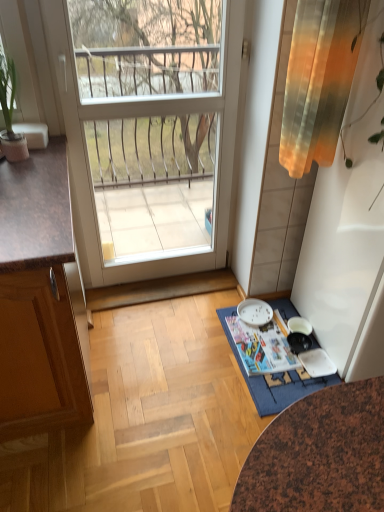
Question: In the image, is white glossy plate at lower center on the left side or the right side of gradient fabric curtain at upper right?

Choices:
 (A) left
 (B) right

Answer: (A)

Question: Do you think white glossy plate at lower center is within gradient fabric curtain at upper right, or outside of it?

Choices:
 (A) outside
 (B) inside

Answer: (A)

Question: Considering the real-world distances, which object is farthest from the white glossy door at center?

Choices:
 (A) green leafy plant in pot at left
 (B) gradient fabric curtain at upper right
 (C) blue fabric doormat at lower center
 (D) white glossy plate at lower center

Answer: (C)

Question: Considering the real-world distances, which object is closest to the white glossy door at center?

Choices:
 (A) white glossy plate at lower center
 (B) gradient fabric curtain at upper right
 (C) green leafy plant in pot at left
 (D) blue fabric doormat at lower center

Answer: (C)